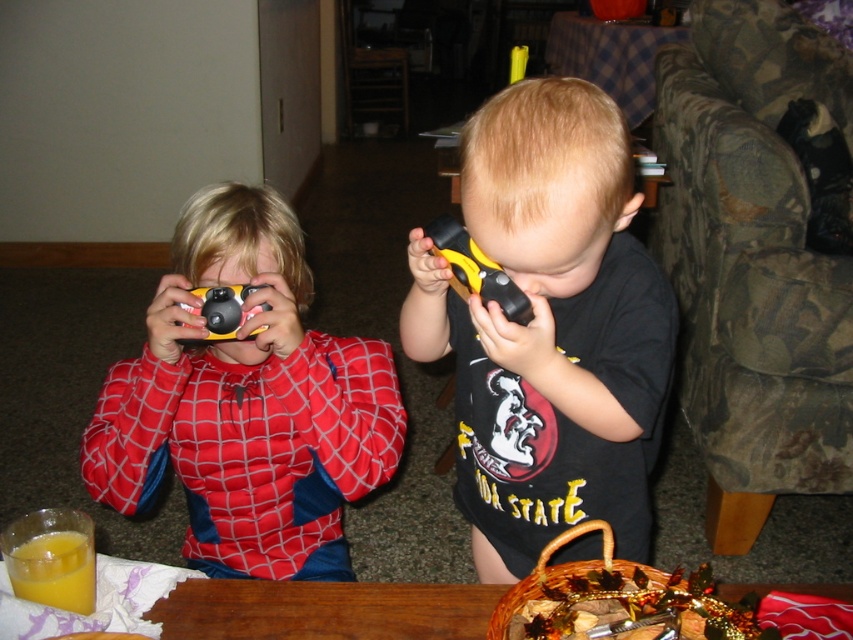
Question: In this image, where is black matte toy phone at center located relative to translucent glass at lower left?

Choices:
 (A) left
 (B) right

Answer: (B)

Question: Is black matte toy phone at center wider than matte black toy at center?

Choices:
 (A) no
 (B) yes

Answer: (B)

Question: Does black matte toy phone at center appear on the left side of matte plastic camera at left?

Choices:
 (A) no
 (B) yes

Answer: (A)

Question: Among these points, which one is farthest from the camera?

Choices:
 (A) (88, 572)
 (B) (469, 116)
 (C) (462, 234)
 (D) (216, 323)

Answer: (D)

Question: Which point is farther to the camera?

Choices:
 (A) black matte toy phone at center
 (B) matte black toy at center
 (C) translucent glass at lower left

Answer: (B)

Question: Which is farther from the matte plastic camera at left?

Choices:
 (A) translucent glass at lower left
 (B) yellow plastic flashlight at center

Answer: (B)